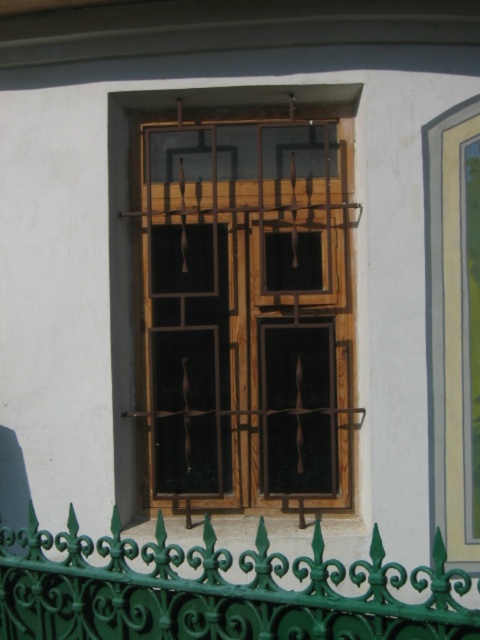
Question: Does wooden window at center come in front of green wrought iron fence at lower center?

Choices:
 (A) yes
 (B) no

Answer: (B)

Question: Which point is closer to the camera?

Choices:
 (A) green wrought iron fence at lower center
 (B) wooden window at center

Answer: (A)

Question: Does wooden window at center appear on the left side of green wrought iron fence at lower center?

Choices:
 (A) no
 (B) yes

Answer: (A)

Question: From the image, what is the correct spatial relationship of wooden window at center in relation to green wrought iron fence at lower center?

Choices:
 (A) left
 (B) right

Answer: (B)